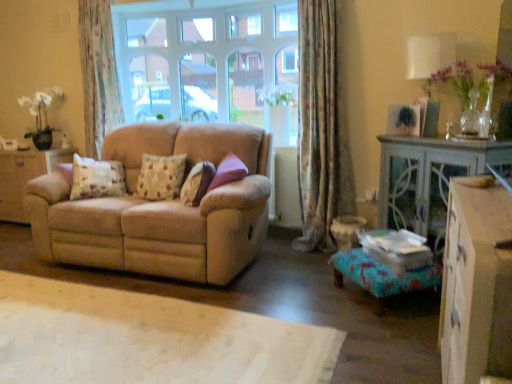
Locate an element on the screen. fluffy beige pillow at center, the first pillow in the right-to-left sequence is located at coordinates (197, 183).

What do you see at coordinates (476, 284) in the screenshot? The height and width of the screenshot is (384, 512). I see `wooden cabinet at lower right, arranged as the first dresser when viewed from the right` at bounding box center [476, 284].

What do you see at coordinates (471, 116) in the screenshot?
I see `clear glass vase at upper right` at bounding box center [471, 116].

What is the approximate width of clear glass vase at upper right?

The width of clear glass vase at upper right is 5.65 inches.

What do you see at coordinates (321, 130) in the screenshot?
I see `floral fabric curtain at center, placed as the second curtain when sorted from left to right` at bounding box center [321, 130].

I want to click on white fabric lampshade at upper right, so click(429, 55).

Is fluffy beige pillow at center, the first pillow in the right-to-left sequence, at the back of beige corduroy couch at center?

Yes, beige corduroy couch at center is positioned with its back facing fluffy beige pillow at center, the first pillow in the right-to-left sequence.

In terms of size, does beige corduroy couch at center appear bigger or smaller than fluffy beige pillow at center, the first pillow in the right-to-left sequence?

beige corduroy couch at center is bigger than fluffy beige pillow at center, the first pillow in the right-to-left sequence.

Considering the relative positions of beige corduroy couch at center and fluffy beige pillow at center, which is the 3th pillow in left-to-right order, in the image provided, is beige corduroy couch at center to the left of fluffy beige pillow at center, which is the 3th pillow in left-to-right order, from the viewer's perspective?

Indeed, beige corduroy couch at center is positioned on the left side of fluffy beige pillow at center, which is the 3th pillow in left-to-right order.

In terms of height, does beige corduroy couch at center look taller or shorter compared to fluffy beige pillow at center, the first pillow in the right-to-left sequence?

Considering their sizes, beige corduroy couch at center has more height than fluffy beige pillow at center, the first pillow in the right-to-left sequence.

From a real-world perspective, between fluffy floral pillow at center, the 2th pillow from the right, and fluffy beige pillow at center, which is the 3th pillow in left-to-right order, who is vertically higher?

fluffy beige pillow at center, which is the 3th pillow in left-to-right order, is physically above.

Which of these two, fluffy floral pillow at center, the 2th pillow from the right, or fluffy beige pillow at center, which is the 3th pillow in left-to-right order, stands shorter?

Standing shorter between the two is fluffy floral pillow at center, the 2th pillow from the right.

How far apart are fluffy floral pillow at center, which is counted as the second pillow, starting from the left, and fluffy beige pillow at center, which is the 3th pillow in left-to-right order?

10.13 inches.

Between fluffy floral pillow at center, which is counted as the second pillow, starting from the left, and beige fabric sofa at left, the second dresser when ordered from front to back, which one is positioned in front?

Positioned in front is fluffy floral pillow at center, which is counted as the second pillow, starting from the left.

Considering the sizes of objects fluffy floral pillow at center, the 2th pillow from the right, and beige fabric sofa at left, which is the 1th dresser in left-to-right order, in the image provided, who is bigger, fluffy floral pillow at center, the 2th pillow from the right, or beige fabric sofa at left, which is the 1th dresser in left-to-right order,?

beige fabric sofa at left, which is the 1th dresser in left-to-right order.

Considering the relative sizes of fluffy floral pillow at center, the 2th pillow from the right, and beige fabric sofa at left, which is the 1th dresser in left-to-right order, in the image provided, is fluffy floral pillow at center, the 2th pillow from the right, taller than beige fabric sofa at left, which is the 1th dresser in left-to-right order,?

In fact, fluffy floral pillow at center, the 2th pillow from the right, may be shorter than beige fabric sofa at left, which is the 1th dresser in left-to-right order.

Does fluffy floral pillow at center, the 2th pillow from the right, have a lesser width compared to beige fabric sofa at left, the second dresser when ordered from front to back?

Yes.

Is floral fabric curtain at center, placed as the second curtain when sorted from left to right, oriented towards beige corduroy couch at center?

No, floral fabric curtain at center, placed as the second curtain when sorted from left to right, is not oriented towards beige corduroy couch at center.

Considering the relative positions of floral fabric curtain at center, positioned as the 1th curtain in right-to-left order, and beige corduroy couch at center in the image provided, is floral fabric curtain at center, positioned as the 1th curtain in right-to-left order, to the left of beige corduroy couch at center from the viewer's perspective?

In fact, floral fabric curtain at center, positioned as the 1th curtain in right-to-left order, is to the right of beige corduroy couch at center.

Who is shorter, floral fabric curtain at center, which ranks as the second curtain in back-to-front order, or beige corduroy couch at center?

beige corduroy couch at center.

How different are the orientations of floral fabric curtain at center, positioned as the 1th curtain in right-to-left order, and beige corduroy couch at center in degrees?

0.695 degrees.

From the image's perspective, between white fabric lampshade at upper right and clear glass vase at upper right, who is located below?

clear glass vase at upper right.

Measure the distance between white fabric lampshade at upper right and clear glass vase at upper right.

white fabric lampshade at upper right and clear glass vase at upper right are 14.63 inches apart.

Does white fabric lampshade at upper right have a larger size compared to clear glass vase at upper right?

Correct, white fabric lampshade at upper right is larger in size than clear glass vase at upper right.

Would you say white fabric lampshade at upper right is inside or outside clear glass vase at upper right?

white fabric lampshade at upper right is not enclosed by clear glass vase at upper right.

Considering the sizes of fluffy beige pillow at center, which is the 3th pillow in left-to-right order, and beige corduroy couch at center in the image, is fluffy beige pillow at center, which is the 3th pillow in left-to-right order, taller or shorter than beige corduroy couch at center?

In the image, fluffy beige pillow at center, which is the 3th pillow in left-to-right order, appears to be shorter than beige corduroy couch at center.

Is fluffy beige pillow at center, which is the 3th pillow in left-to-right order, far away from beige corduroy couch at center?

No, there isn't a large distance between fluffy beige pillow at center, which is the 3th pillow in left-to-right order, and beige corduroy couch at center.

Between fluffy beige pillow at center, the first pillow in the right-to-left sequence, and beige corduroy couch at center, which one has larger size?

beige corduroy couch at center is bigger.

From the image's perspective, between clear glass vase at upper right and floral-patterned fabric pillow at left, which is the first pillow from left to right, which one is located above?

clear glass vase at upper right is shown above in the image.

Is clear glass vase at upper right at the right side of floral-patterned fabric pillow at left, which is the first pillow from left to right?

Indeed, clear glass vase at upper right is positioned on the right side of floral-patterned fabric pillow at left, which is the first pillow from left to right.

Is clear glass vase at upper right next to floral-patterned fabric pillow at left, which is the first pillow from left to right?

No, clear glass vase at upper right is not with floral-patterned fabric pillow at left, which is the first pillow from left to right.

Does clear glass vase at upper right have a greater width compared to floral-patterned fabric pillow at left, which ranks as the 3th pillow in right-to-left order?

No.

From the image's perspective, which pillow is the 1st one above the beige corduroy couch at center? Please provide its 2D coordinates.

[(197, 183)]

This screenshot has height=384, width=512. What are the coordinates of `pillow located in front of the fluffy floral pillow at center, the 2th pillow from the right` in the screenshot? It's located at (197, 183).

Estimate the real-world distances between objects in this image. Which object is further from floral-patterned fabric pillow at left, which is the first pillow from left to right, beige corduroy couch at center or floral fabric curtain at upper left, marked as the 1th curtain in a left-to-right arrangement?

Among the two, floral fabric curtain at upper left, marked as the 1th curtain in a left-to-right arrangement, is located further to floral-patterned fabric pillow at left, which is the first pillow from left to right.

Based on their spatial positions, is floral-patterned fabric pillow at left, which is the first pillow from left to right, or fluffy floral pillow at center, the 2th pillow from the right, closer to clear glass vase at upper right?

fluffy floral pillow at center, the 2th pillow from the right.

From the image, which object appears to be nearer to fluffy floral pillow at center, the 2th pillow from the right, fluffy beige pillow at center, the first pillow in the right-to-left sequence, or floral fabric curtain at center, which ranks as the second curtain in back-to-front order?

fluffy beige pillow at center, the first pillow in the right-to-left sequence.

From the picture: Estimate the real-world distances between objects in this image. Which object is closer to white fabric lampshade at upper right, clear glass vase at upper right or floral-patterned fabric pillow at left, which is the first pillow from left to right?

clear glass vase at upper right.

Which object lies nearer to the anchor point floral fabric curtain at center, placed as the second curtain when sorted from left to right, beige corduroy couch at center or clear glass vase at upper right?

clear glass vase at upper right is closer to floral fabric curtain at center, placed as the second curtain when sorted from left to right.

Considering their positions, is floral fabric curtain at center, placed as the second curtain when sorted from left to right, positioned further to white fabric lampshade at upper right than floral fabric curtain at upper left, the 1th curtain viewed from the back?

The object further to white fabric lampshade at upper right is floral fabric curtain at upper left, the 1th curtain viewed from the back.

Which object lies nearer to the anchor point turquoise fabric footrest at lower right, beige corduroy couch at center or clear glass vase at upper right?

Among the two, clear glass vase at upper right is located nearer to turquoise fabric footrest at lower right.

When comparing their distances from turquoise fabric footrest at lower right, does white fabric lampshade at upper right or floral fabric curtain at center, placed as the second curtain when sorted from left to right, seem closer?

floral fabric curtain at center, placed as the second curtain when sorted from left to right, lies closer to turquoise fabric footrest at lower right than the other object.

The image size is (512, 384). I want to click on table between wooden cabinet at lower right, which is the 2th dresser in back-to-front order, and clear glass vase at upper right, along the z-axis, so click(429, 179).

Identify the location of dresser between beige corduroy couch at center and wooden cabinet at right in the horizontal direction. (476, 284).

The image size is (512, 384). I want to click on table between beige corduroy couch at center and clear glass vase at upper right, so click(x=429, y=179).

The height and width of the screenshot is (384, 512). I want to click on table between wooden cabinet at lower right, which is the 2th dresser from left to right, and white fabric lampshade at upper right in the front-back direction, so click(x=429, y=179).